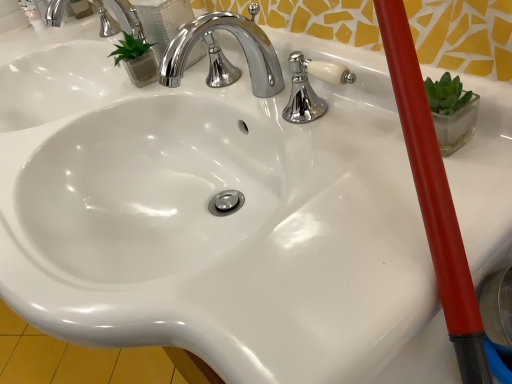
Image resolution: width=512 pixels, height=384 pixels. What do you see at coordinates (118, 18) in the screenshot? I see `polished chrome faucet at upper center, which appears as the 1th tap when viewed from the top` at bounding box center [118, 18].

I want to click on polished chrome faucet at upper center, which is the 2th tap in front-to-back order, so click(x=118, y=18).

You are a GUI agent. You are given a task and a screenshot of the screen. Output one action in this format:
    pyautogui.click(x=<x>, y=<y>)
    Task: Click on the chrome/metallic faucet at center, the second tap positioned from the top
    
    Given the screenshot: What is the action you would take?
    pyautogui.click(x=238, y=41)

This screenshot has height=384, width=512. Describe the element at coordinates (238, 41) in the screenshot. I see `chrome/metallic faucet at center, the second tap positioned from the top` at that location.

You are a GUI agent. You are given a task and a screenshot of the screen. Output one action in this format:
    pyautogui.click(x=<x>, y=<y>)
    Task: Click on the polished chrome faucet at upper center, the second tap when ordered from right to left
    Image resolution: width=512 pixels, height=384 pixels.
    Given the screenshot: What is the action you would take?
    pyautogui.click(x=118, y=18)

Is chrome/metallic faucet at center, which is the 2th tap from left to right, at the right side of polished chrome faucet at upper center, which ranks as the second tap in bottom-to-top order?

Yes.

Considering their positions, is chrome/metallic faucet at center, the second tap positioned from the top, located in front of or behind polished chrome faucet at upper center, the second tap when ordered from right to left?

Clearly, chrome/metallic faucet at center, the second tap positioned from the top, is in front of polished chrome faucet at upper center, the second tap when ordered from right to left.

Considering the points (186, 43) and (59, 25), which point is in front, point (186, 43) or point (59, 25)?

Point (186, 43)

From the image's perspective, which one is positioned lower, chrome/metallic faucet at center, the second tap positioned from the top, or polished chrome faucet at upper center, which appears as the 1th tap when viewed from the left?

chrome/metallic faucet at center, the second tap positioned from the top.

From a real-world perspective, is chrome/metallic faucet at center, placed as the first tap when sorted from bottom to top, over polished chrome faucet at upper center, which ranks as the second tap in bottom-to-top order?

No, from a real-world perspective, chrome/metallic faucet at center, placed as the first tap when sorted from bottom to top, is not on top of polished chrome faucet at upper center, which ranks as the second tap in bottom-to-top order.

Considering the relative sizes of chrome/metallic faucet at center, which is the 2th tap from left to right, and polished chrome faucet at upper center, which appears as the 1th tap when viewed from the left, in the image provided, is chrome/metallic faucet at center, which is the 2th tap from left to right, thinner than polished chrome faucet at upper center, which appears as the 1th tap when viewed from the left,?

No.

Does chrome/metallic faucet at center, the 1th tap in the right-to-left sequence, have a greater height compared to polished chrome faucet at upper center, which appears as the 1th tap when viewed from the top?

Incorrect, the height of chrome/metallic faucet at center, the 1th tap in the right-to-left sequence, is not larger of that of polished chrome faucet at upper center, which appears as the 1th tap when viewed from the top.

Can you confirm if chrome/metallic faucet at center, acting as the 2th tap starting from the back, is smaller than polished chrome faucet at upper center, which appears as the 1th tap when viewed from the left?

Indeed, chrome/metallic faucet at center, acting as the 2th tap starting from the back, has a smaller size compared to polished chrome faucet at upper center, which appears as the 1th tap when viewed from the left.

Is polished chrome faucet at upper center, which appears as the 1th tap when viewed from the left, surrounded by chrome/metallic faucet at center, acting as the 2th tap starting from the back?

Actually, polished chrome faucet at upper center, which appears as the 1th tap when viewed from the left, is outside chrome/metallic faucet at center, acting as the 2th tap starting from the back.

Would you say chrome/metallic faucet at center, the 1th tap in the right-to-left sequence, is a long distance from polished chrome faucet at upper center, which is the first tap from back to front?

chrome/metallic faucet at center, the 1th tap in the right-to-left sequence, is actually quite close to polished chrome faucet at upper center, which is the first tap from back to front.

Is chrome/metallic faucet at center, the second tap positioned from the top, looking in the opposite direction of polished chrome faucet at upper center, which appears as the 1th tap when viewed from the top?

No, chrome/metallic faucet at center, the second tap positioned from the top, is not facing the opposite direction of polished chrome faucet at upper center, which appears as the 1th tap when viewed from the top.

Where is `tap on the right side of polished chrome faucet at upper center, which appears as the 1th tap when viewed from the left`? tap on the right side of polished chrome faucet at upper center, which appears as the 1th tap when viewed from the left is located at coordinates (238, 41).

Would you say polished chrome faucet at upper center, the second tap when ordered from right to left, is to the left or to the right of chrome/metallic faucet at center, the 1th tap in the right-to-left sequence, in the picture?

polished chrome faucet at upper center, the second tap when ordered from right to left, is positioned on chrome/metallic faucet at center, the 1th tap in the right-to-left sequence,'s left side.

Considering their positions, is polished chrome faucet at upper center, which ranks as the second tap in bottom-to-top order, located in front of or behind chrome/metallic faucet at center, the 1th tap in the right-to-left sequence?

Clearly, polished chrome faucet at upper center, which ranks as the second tap in bottom-to-top order, is behind chrome/metallic faucet at center, the 1th tap in the right-to-left sequence.

Which point is more forward, (50, 18) or (242, 37)?

The point (242, 37) is closer.

From the image's perspective, who appears lower, polished chrome faucet at upper center, which is the 2th tap in front-to-back order, or chrome/metallic faucet at center, acting as the 2th tap starting from the back?

chrome/metallic faucet at center, acting as the 2th tap starting from the back, is shown below in the image.

From a real-world perspective, which is physically above, polished chrome faucet at upper center, which ranks as the second tap in bottom-to-top order, or chrome/metallic faucet at center, the first tap when ordered from front to back?

polished chrome faucet at upper center, which ranks as the second tap in bottom-to-top order, from a real-world perspective.

Which of these two, polished chrome faucet at upper center, which appears as the 1th tap when viewed from the left, or chrome/metallic faucet at center, acting as the 2th tap starting from the back, is thinner?

chrome/metallic faucet at center, acting as the 2th tap starting from the back, is thinner.

Is polished chrome faucet at upper center, which appears as the 1th tap when viewed from the top, taller or shorter than chrome/metallic faucet at center, which is the 2th tap from left to right?

Considering their sizes, polished chrome faucet at upper center, which appears as the 1th tap when viewed from the top, has more height than chrome/metallic faucet at center, which is the 2th tap from left to right.

Considering the relative sizes of polished chrome faucet at upper center, which ranks as the second tap in bottom-to-top order, and chrome/metallic faucet at center, placed as the first tap when sorted from bottom to top, in the image provided, is polished chrome faucet at upper center, which ranks as the second tap in bottom-to-top order, smaller than chrome/metallic faucet at center, placed as the first tap when sorted from bottom to top,?

Incorrect, polished chrome faucet at upper center, which ranks as the second tap in bottom-to-top order, is not smaller in size than chrome/metallic faucet at center, placed as the first tap when sorted from bottom to top.

Is polished chrome faucet at upper center, which appears as the 1th tap when viewed from the left, not inside chrome/metallic faucet at center, acting as the 2th tap starting from the back?

Absolutely, polished chrome faucet at upper center, which appears as the 1th tap when viewed from the left, is external to chrome/metallic faucet at center, acting as the 2th tap starting from the back.

Is polished chrome faucet at upper center, which is the first tap from back to front, looking in the opposite direction of chrome/metallic faucet at center, placed as the first tap when sorted from bottom to top?

No, chrome/metallic faucet at center, placed as the first tap when sorted from bottom to top, is not at the back of polished chrome faucet at upper center, which is the first tap from back to front.

How many degrees apart are the facing directions of polished chrome faucet at upper center, the second tap when ordered from right to left, and chrome/metallic faucet at center, the 1th tap in the right-to-left sequence?

There is a 0-degree angle between the facing directions of polished chrome faucet at upper center, the second tap when ordered from right to left, and chrome/metallic faucet at center, the 1th tap in the right-to-left sequence.

Identify the location of tap on the left side of chrome/metallic faucet at center, the first tap when ordered from front to back. (118, 18).

Where is `tap that appears above the chrome/metallic faucet at center, the second tap positioned from the top (from a real-world perspective)`? The height and width of the screenshot is (384, 512). tap that appears above the chrome/metallic faucet at center, the second tap positioned from the top (from a real-world perspective) is located at coordinates (118, 18).

In the image, there is a polished chrome faucet at upper center, which ranks as the second tap in bottom-to-top order. Where is `tap below it (from the image's perspective)`? This screenshot has height=384, width=512. tap below it (from the image's perspective) is located at coordinates (238, 41).